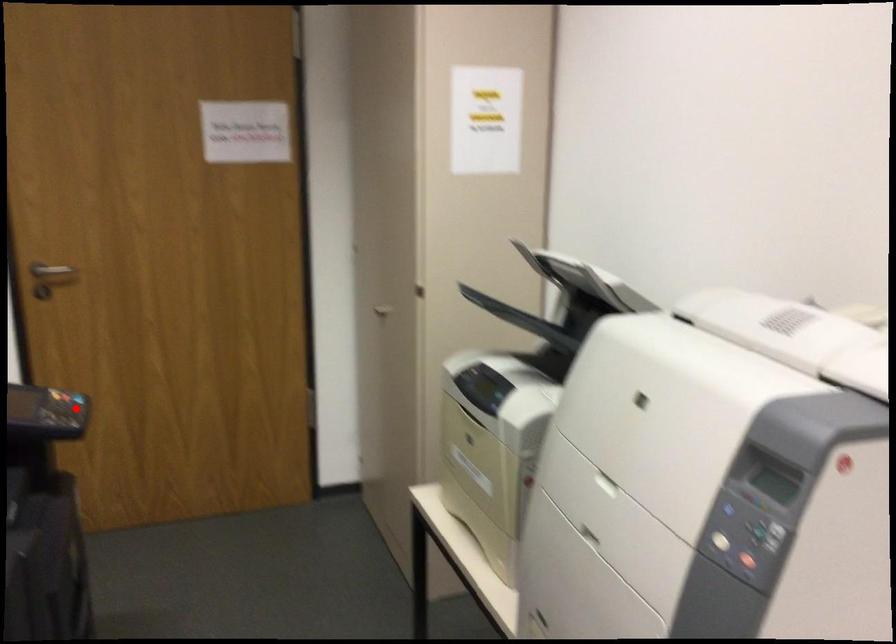
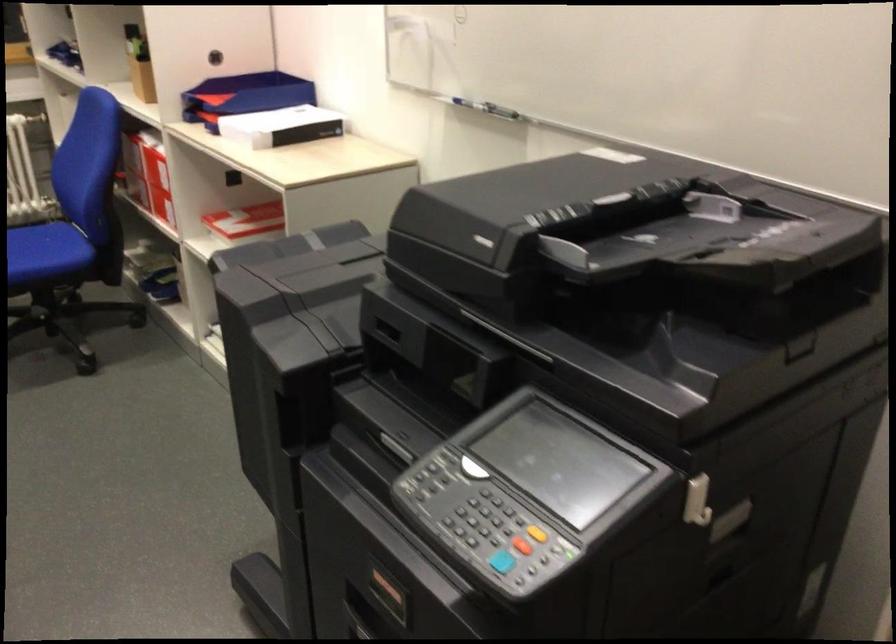
Find the pixel in the second image that matches the highlighted location in the first image.

(502, 562)